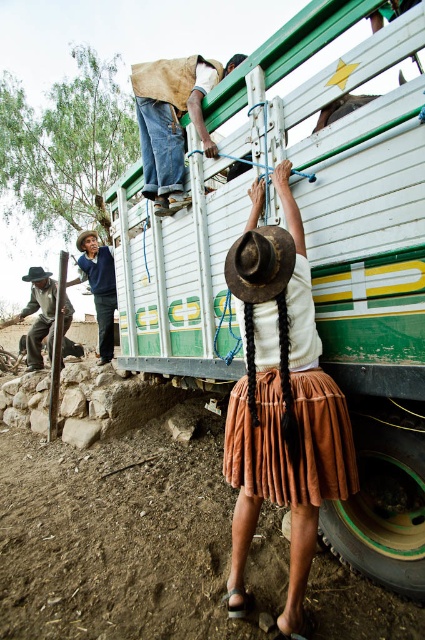
Question: Which of the following is the farthest from the observer?

Choices:
 (A) (x=82, y=257)
 (B) (x=325, y=400)
 (C) (x=20, y=310)

Answer: (C)

Question: Does brown canvas bag at upper center have a greater width compared to brown leather cowboy hat at center?

Choices:
 (A) yes
 (B) no

Answer: (A)

Question: Which point is closer to the camera taking this photo?

Choices:
 (A) (76, 241)
 (B) (108, 324)
 (C) (47, 275)
 (D) (36, 342)

Answer: (B)

Question: Which object is the farthest from the black silky hair at center?

Choices:
 (A) brown pleated skirt at center
 (B) white matte trailer truck at center
 (C) brown canvas bag at upper center
 (D) brown felt cowboy hat at center

Answer: (D)

Question: From the image, what is the correct spatial relationship of brown leather cowboy hat at center in relation to brown felt cowboy hat at center?

Choices:
 (A) left
 (B) right

Answer: (B)

Question: Can you confirm if white matte trailer truck at center is positioned to the left of brown pleated skirt at center?

Choices:
 (A) no
 (B) yes

Answer: (B)